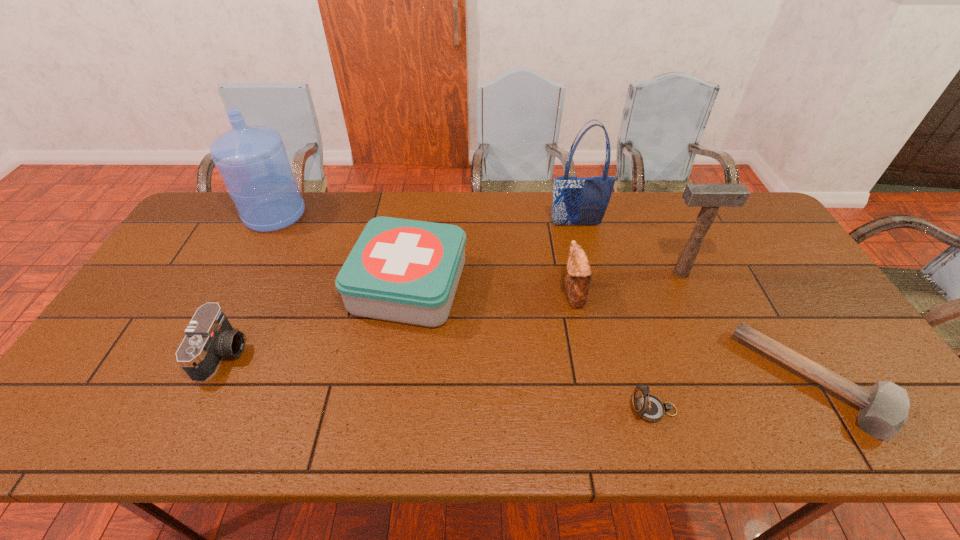
Where is `the nearer mallet`? The image size is (960, 540). the nearer mallet is located at coordinates (884, 408).

Find the location of a particular element. The image size is (960, 540). blank space located 0.280m on the front-facing side of the shopping bag is located at coordinates (591, 291).

At what (x,y) coordinates should I click in order to perform the action: click on blank space located on the front of the farther mallet. Please return your answer as a coordinate pair (x, y). This screenshot has width=960, height=540. Looking at the image, I should click on (710, 340).

In order to click on vacant space located 0.140m on the open side of the fourth tallest object in this screenshot , I will do `click(513, 296)`.

The width and height of the screenshot is (960, 540). I want to click on vacant space located on the open side of the fourth tallest object, so click(467, 296).

Where is `free space located on the open side of the fourth tallest object`? free space located on the open side of the fourth tallest object is located at coordinates (509, 296).

At what (x,y) coordinates should I click in order to perform the action: click on free space located 0.200m on the right of the first-aid kit. Please return your answer as a coordinate pair (x, y). The width and height of the screenshot is (960, 540). Looking at the image, I should click on (536, 286).

Locate an element on the screen. This screenshot has width=960, height=540. free space located 0.060m on the front-facing side of the camera is located at coordinates (268, 353).

Identify the location of free space located 0.070m on the face of the compass. This screenshot has width=960, height=540. (600, 410).

This screenshot has width=960, height=540. In order to click on free location located on the face of the compass in this screenshot , I will do `click(487, 410)`.